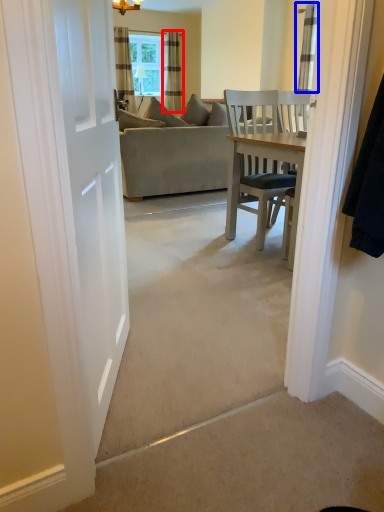
Question: Which of the following is the closest to the observer, curtain (highlighted by a red box) or curtain (highlighted by a blue box)?

Choices:
 (A) curtain
 (B) curtain

Answer: (B)